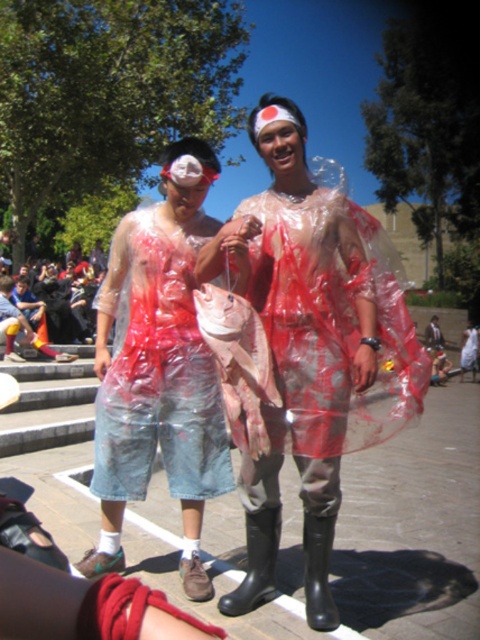
Question: Does transparent plastic bag at center have a larger size compared to matte plastic bag at center?

Choices:
 (A) yes
 (B) no

Answer: (B)

Question: Among these points, which one is nearest to the camera?

Choices:
 (A) (140, 436)
 (B) (8, 307)
 (C) (310, 362)

Answer: (C)

Question: Does transparent plastic fish at center have a larger size compared to matte plastic bag at center?

Choices:
 (A) no
 (B) yes

Answer: (A)

Question: Based on their relative distances, which object is nearer to the matte plastic bag at center?

Choices:
 (A) transparent plastic bag at center
 (B) transparent plastic fish at center

Answer: (A)

Question: Which object is closer to the camera taking this photo?

Choices:
 (A) transparent plastic fish at center
 (B) transparent plastic bag at center

Answer: (A)

Question: Can you confirm if transparent plastic bag at center is smaller than matte plastic bag at center?

Choices:
 (A) yes
 (B) no

Answer: (A)